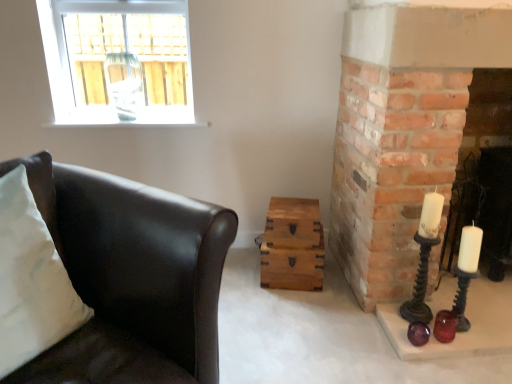
Question: Does point (297, 221) appear closer or farther from the camera than point (416, 304)?

Choices:
 (A) closer
 (B) farther

Answer: (B)

Question: From a real-world perspective, is wooden chest at center, the 2th drawer in the bottom-to-top sequence, positioned above or below matte black candle holder at right, which is the 2th candle holder from bottom to top?

Choices:
 (A) above
 (B) below

Answer: (B)

Question: Which object is positioned closest to the matte black candle holder at right, which is the 2th candle holder from bottom to top?

Choices:
 (A) wooden chest at center, the 1th drawer in the bottom-to-top sequence
 (B) transparent glass window at upper left
 (C) smooth brick fireplace at right
 (D) white soft cushion at left
 (E) matte black leather couch at left

Answer: (A)

Question: Estimate the real-world distances between objects in this image. Which object is closer to the translucent amber glass candle holder at lower right, marked as the 1th candle holder in a bottom-to-top arrangement?

Choices:
 (A) transparent glass window at upper left
 (B) matte black leather couch at left
 (C) white soft cushion at left
 (D) matte black candle holder at right, which appears as the first candle holder when viewed from the top
 (E) smooth brick fireplace at right

Answer: (D)